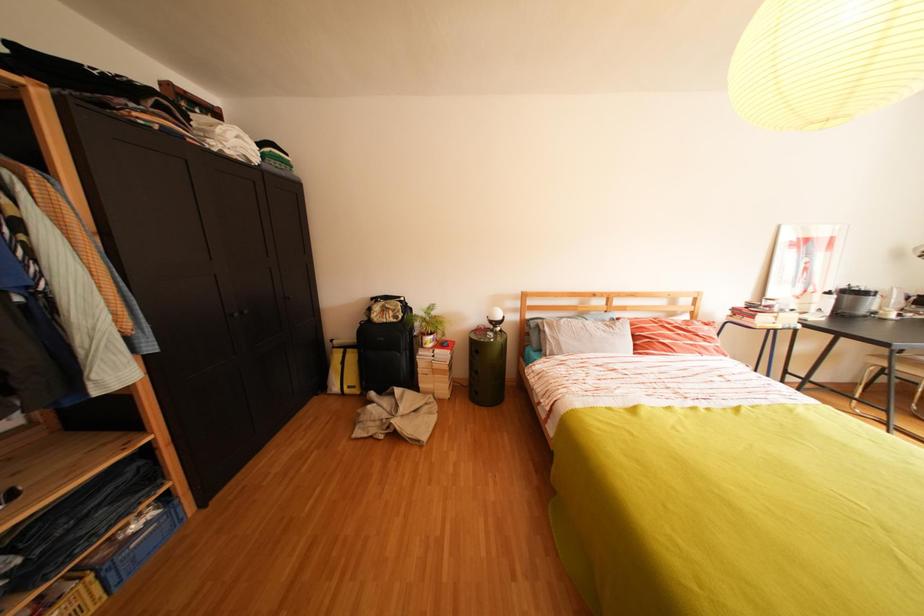
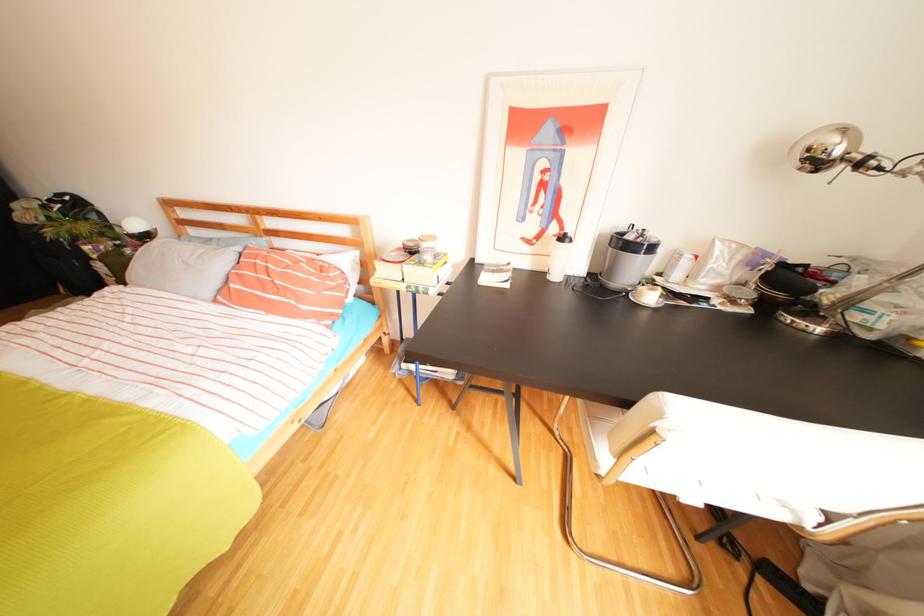
Question: Which direction would the cameraman need to move to produce the second image? Reply with the corresponding letter.

Choices:
 (A) Left
 (B) Right
 (C) Forward
 (D) Backward

Answer: (B)